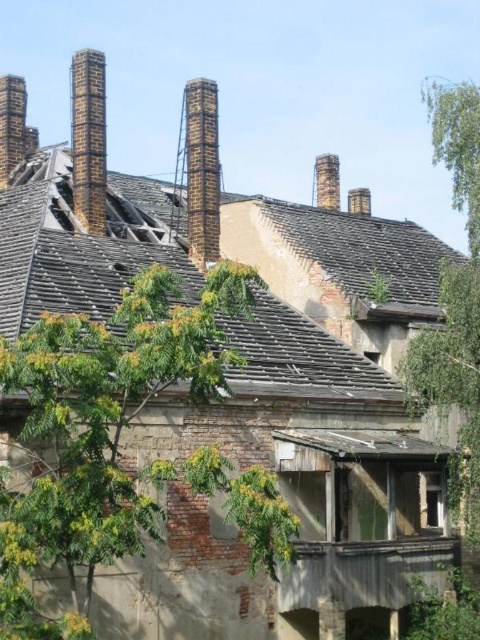
Question: Does green leafy tree at center have a smaller size compared to dark brown brick chimney at upper left?

Choices:
 (A) no
 (B) yes

Answer: (A)

Question: Does weathered wood roof at upper center appear over green leafy tree at upper right?

Choices:
 (A) yes
 (B) no

Answer: (B)

Question: Which object is positioned farthest from the weathered wood roof at upper center?

Choices:
 (A) brick chimney at upper left
 (B) green leafy tree at center
 (C) brick chimney at upper center

Answer: (C)

Question: Is rusty metal chimney at center positioned at the back of smooth brick chimney at upper center?

Choices:
 (A) no
 (B) yes

Answer: (A)

Question: Which point is closer to the camera?

Choices:
 (A) (25, 93)
 (B) (212, 118)
 (C) (468, 301)

Answer: (C)

Question: Which object is the farthest from the dark brown brick chimney at upper left?

Choices:
 (A) weathered wood roof at upper center
 (B) brick chimney at upper center

Answer: (B)